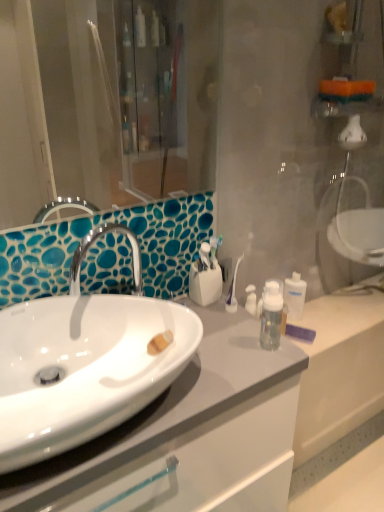
Question: Is white glossy sink at center positioned in front of white glossy cabinet at center?

Choices:
 (A) yes
 (B) no

Answer: (A)

Question: Can you confirm if white glossy sink at center is smaller than white glossy cabinet at center?

Choices:
 (A) yes
 (B) no

Answer: (A)

Question: Could white glossy cabinet at center be considered to be inside white glossy sink at center?

Choices:
 (A) yes
 (B) no

Answer: (B)

Question: From the image's perspective, is white glossy sink at center on white glossy cabinet at center?

Choices:
 (A) yes
 (B) no

Answer: (A)

Question: From a real-world perspective, is white glossy sink at center physically above white glossy cabinet at center?

Choices:
 (A) yes
 (B) no

Answer: (A)

Question: Considering the positions of point (43, 438) and point (299, 309), is point (43, 438) closer or farther from the camera than point (299, 309)?

Choices:
 (A) farther
 (B) closer

Answer: (B)

Question: Would you say white glossy sink at center is inside or outside clear plastic bottle at center-right?

Choices:
 (A) inside
 (B) outside

Answer: (B)

Question: From their relative heights in the image, would you say white glossy sink at center is taller or shorter than clear plastic bottle at center-right?

Choices:
 (A) tall
 (B) short

Answer: (B)

Question: Based on their sizes in the image, would you say white glossy sink at center is bigger or smaller than clear plastic bottle at center-right?

Choices:
 (A) big
 (B) small

Answer: (A)

Question: Considering the relative positions of white glossy cabinet at center and white glossy sink at center in the image provided, is white glossy cabinet at center to the left or to the right of white glossy sink at center?

Choices:
 (A) right
 (B) left

Answer: (A)

Question: From the image's perspective, is white glossy cabinet at center above or below white glossy sink at center?

Choices:
 (A) below
 (B) above

Answer: (A)

Question: Considering the positions of white glossy cabinet at center and white glossy sink at center in the image, is white glossy cabinet at center taller or shorter than white glossy sink at center?

Choices:
 (A) short
 (B) tall

Answer: (B)

Question: From a real-world perspective, is white glossy cabinet at center physically located above or below white glossy sink at center?

Choices:
 (A) below
 (B) above

Answer: (A)

Question: Considering the positions of clear plastic bottle at center-right and white glossy sink at center in the image, is clear plastic bottle at center-right wider or thinner than white glossy sink at center?

Choices:
 (A) thin
 (B) wide

Answer: (A)

Question: Considering the positions of clear plastic bottle at center-right and white glossy sink at center in the image, is clear plastic bottle at center-right bigger or smaller than white glossy sink at center?

Choices:
 (A) small
 (B) big

Answer: (A)